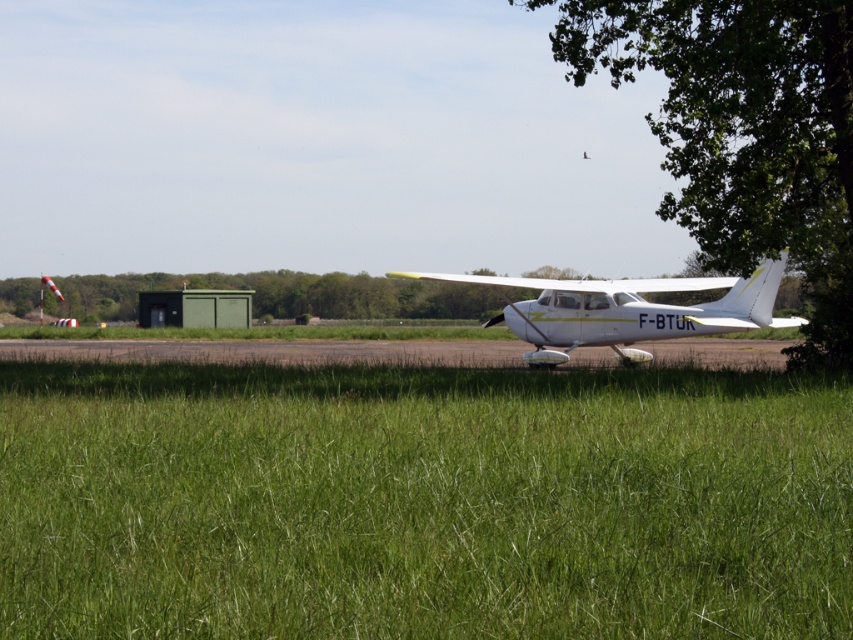
You are a pilot planning to taxi the white matte airplane at center to the runway. There is a green leafy tree at right nearby. Based on their sizes, which object would require more caution when maneuvering around it?

The green leafy tree at right requires more caution when maneuvering around it because it is bigger than the white matte airplane at center.

You are a pilot standing on the green grass at center and want to board the white matte airplane at center. Which direction should you move to reach the airplane?

The green grass at center is closer to the viewer than the white matte airplane at center, so you should move forward towards the white matte airplane at center to reach it.